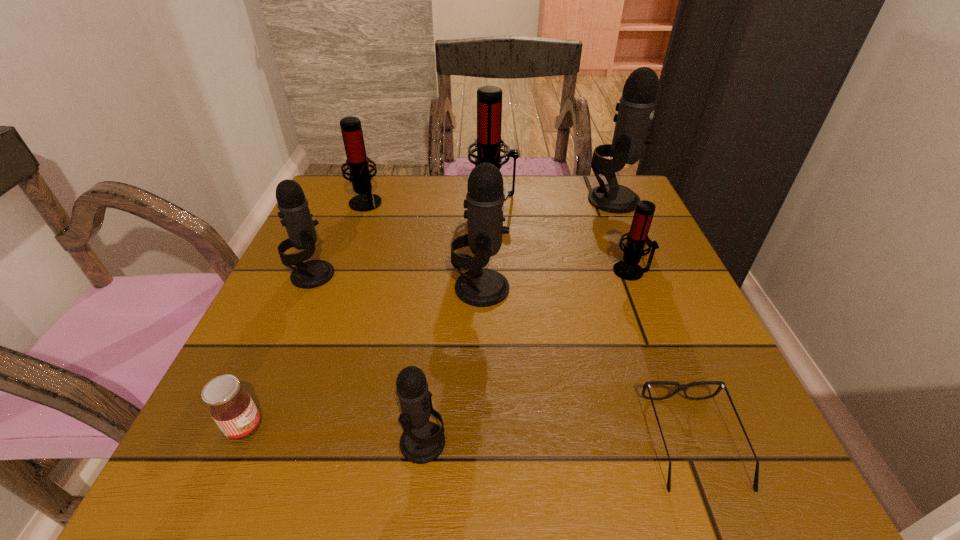
Where is `vacant area between the tallest microphone and the smallest black microphone`? This screenshot has width=960, height=540. vacant area between the tallest microphone and the smallest black microphone is located at coordinates (518, 321).

Identify the location of free space between the nearest microphone and the rightmost red microphone. The width and height of the screenshot is (960, 540). tap(527, 356).

Where is `free space between the jam and the rightmost red microphone`? Image resolution: width=960 pixels, height=540 pixels. free space between the jam and the rightmost red microphone is located at coordinates (438, 349).

Find the location of a particular element. The image size is (960, 540). vacant point located between the eighth tallest object and the leftmost red microphone is located at coordinates (305, 314).

Locate an element on the screen. object that stands as the seventh closest to the leftmost red microphone is located at coordinates (422, 441).

The image size is (960, 540). What are the coordinates of `object that is the seventh nearest to the rightmost red microphone` in the screenshot? It's located at (294, 210).

Choose which microphone is the third nearest neighbor to the eighth tallest object. Please provide its 2D coordinates. Your answer should be formatted as a tuple, i.e. [(x, y)], where the tuple contains the x and y coordinates of a point satisfying the conditions above.

[(484, 201)]

Where is `microphone that stands as the sixth closest to the smallest red microphone`? This screenshot has height=540, width=960. microphone that stands as the sixth closest to the smallest red microphone is located at coordinates (294, 210).

Locate an element on the screen. Image resolution: width=960 pixels, height=540 pixels. black microphone that stands as the third closest to the eighth tallest object is located at coordinates (484, 201).

You are a GUI agent. You are given a task and a screenshot of the screen. Output one action in this format:
    pyautogui.click(x=<x>, y=<y>)
    Task: Click on the closest black microphone to the leftmost black microphone
    This screenshot has height=540, width=960.
    Given the screenshot: What is the action you would take?
    pyautogui.click(x=484, y=201)